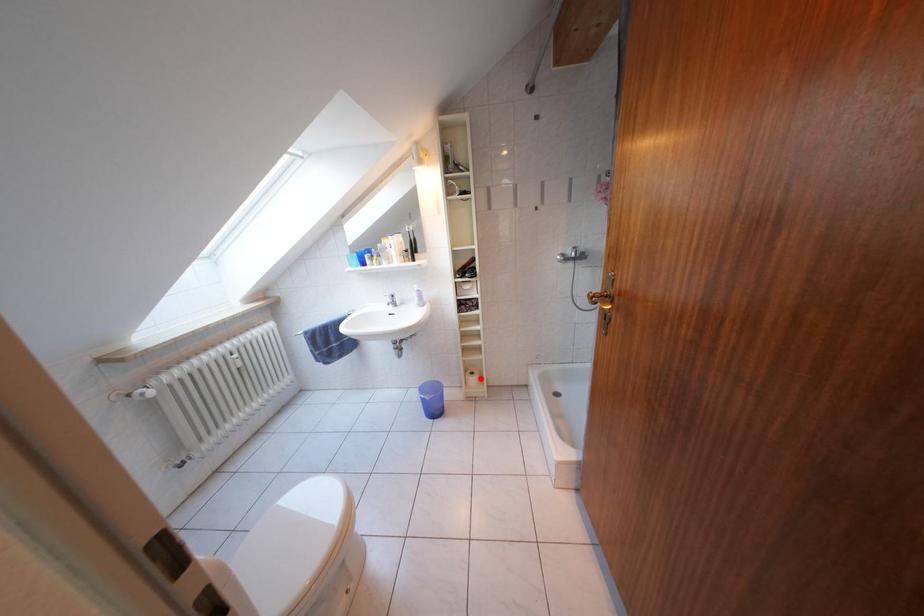
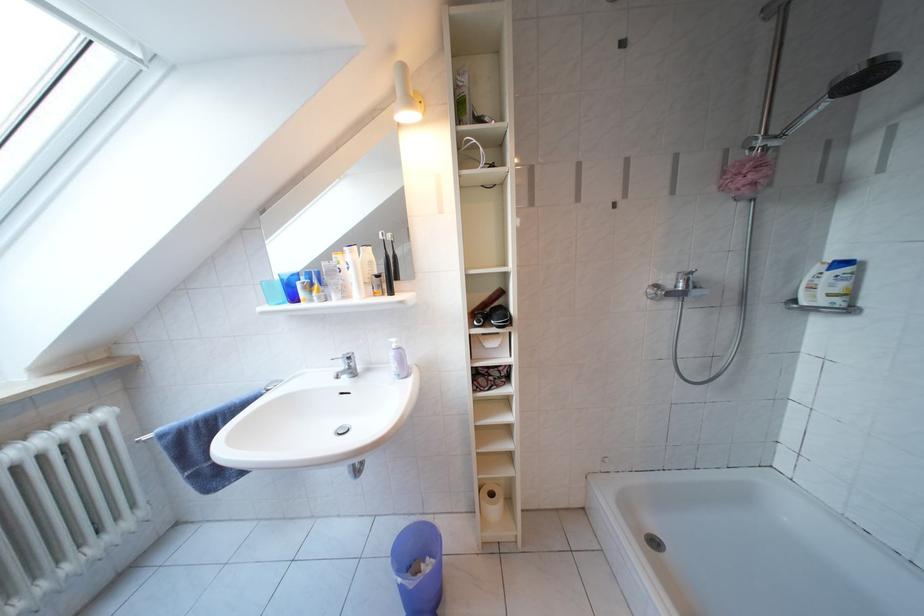
Question: I am providing you with two images of the same scene from different viewpoints. Given a red point in image1, look at the same physical point in image2. Is it:

Choices:
 (A) Closer to the viewpoint
 (B) Farther from the viewpoint

Answer: (A)